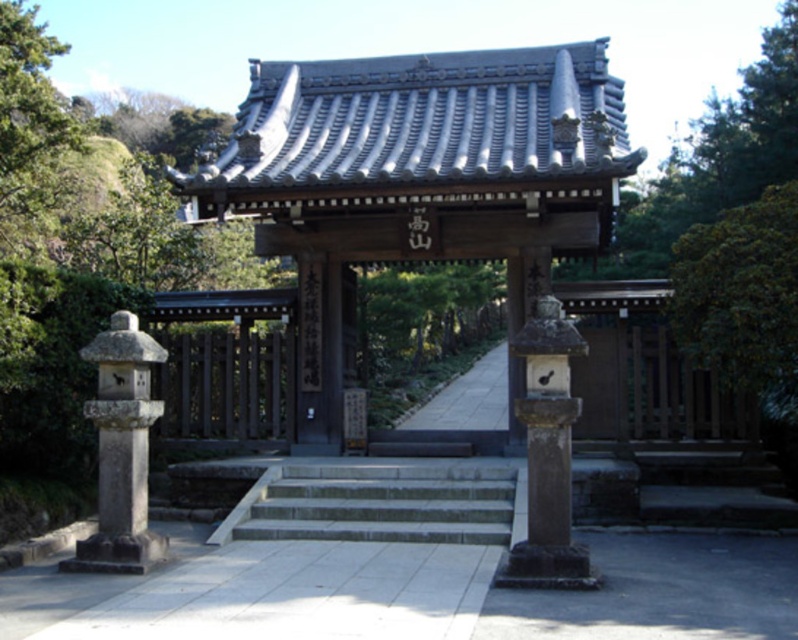
Question: Which object appears farthest from the camera in this image?

Choices:
 (A) smooth stone lantern at center
 (B) gray stone stairs at center
 (C) gray stone lantern at left
 (D) green leafy tree at right

Answer: (B)

Question: Does smooth gray stone gate at center have a lesser width compared to gray stone stairs at center?

Choices:
 (A) yes
 (B) no

Answer: (B)

Question: Which object appears closest to the camera in this image?

Choices:
 (A) smooth stone lantern at center
 (B) smooth gray stone gate at center
 (C) gray stone stairs at center
 (D) green leafy tree at right

Answer: (A)

Question: Can you confirm if smooth stone lantern at center is smaller than gray stone lantern at left?

Choices:
 (A) no
 (B) yes

Answer: (A)

Question: Estimate the real-world distances between objects in this image. Which object is farther from the smooth stone lantern at center?

Choices:
 (A) smooth gray stone gate at center
 (B) green leafy tree at right
 (C) gray stone lantern at left

Answer: (A)

Question: Can you confirm if smooth gray stone gate at center is positioned below smooth stone lantern at center?

Choices:
 (A) yes
 (B) no

Answer: (B)